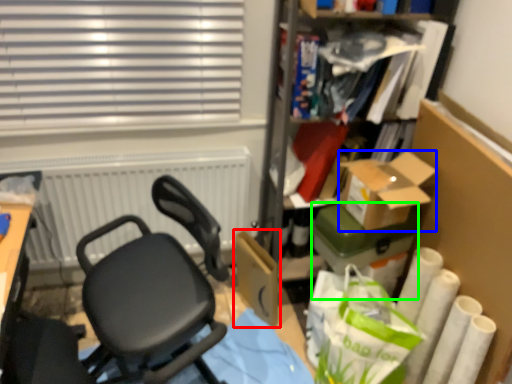
Question: Which is nearer to the cardboard box (highlighted by a red box)? box (highlighted by a blue box) or box (highlighted by a green box).

Choices:
 (A) box
 (B) box

Answer: (B)